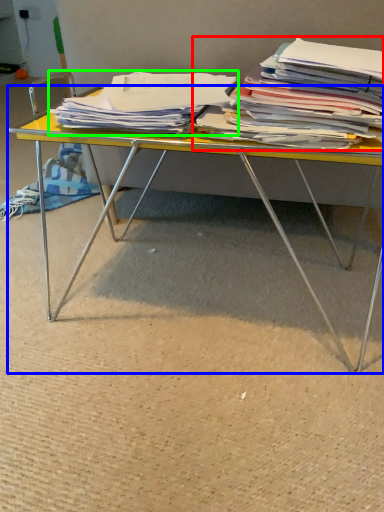
Question: Which object is the farthest from magazine (highlighted by a red box)? Choose among these: desk (highlighted by a blue box) or magazine (highlighted by a green box).

Choices:
 (A) desk
 (B) magazine

Answer: (A)